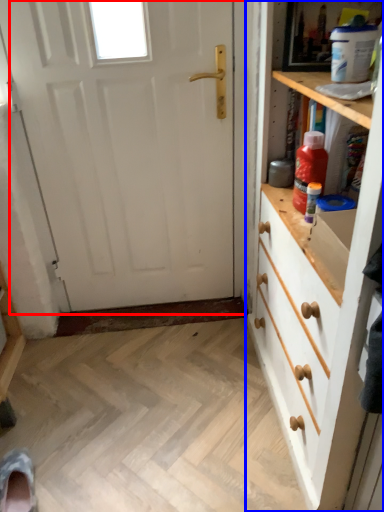
Question: Which object appears farthest to the camera in this image, door (highlighted by a red box) or chest of drawers (highlighted by a blue box)?

Choices:
 (A) door
 (B) chest of drawers

Answer: (A)